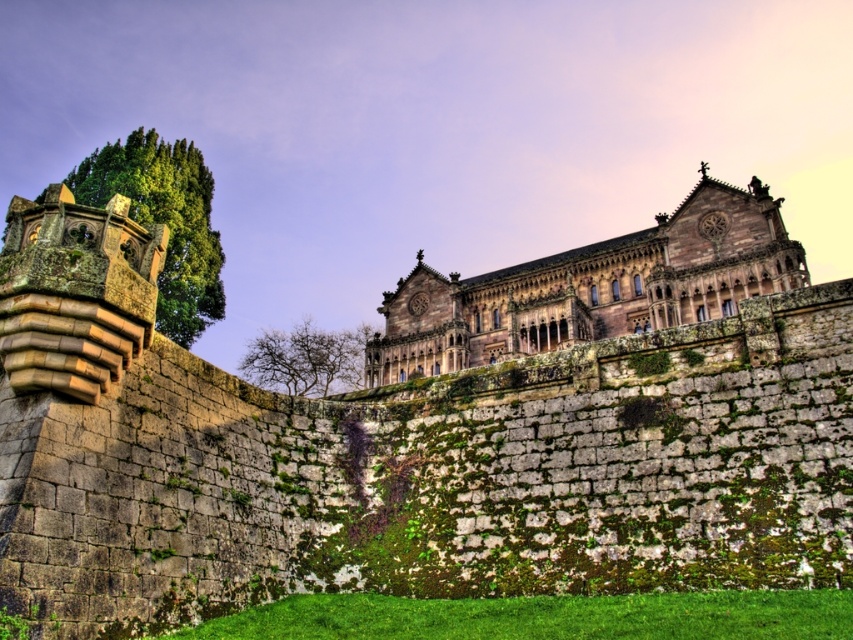
Question: Based on their relative distances, which object is farther from the bare branches at center?

Choices:
 (A) brown stone palace at center
 (B) green leafy tree at left

Answer: (B)

Question: In this image, where is green leafy tree at left located relative to bare branches at center?

Choices:
 (A) above
 (B) below

Answer: (A)

Question: Is green leafy tree at left below bare branches at center?

Choices:
 (A) no
 (B) yes

Answer: (A)

Question: Does green leafy tree at left have a larger size compared to bare branches at center?

Choices:
 (A) yes
 (B) no

Answer: (A)

Question: Which point is farther from the camera taking this photo?

Choices:
 (A) tap(302, 339)
 (B) tap(643, 280)

Answer: (A)

Question: Which of the following is the farthest from the observer?

Choices:
 (A) (358, 364)
 (B) (431, 330)

Answer: (A)